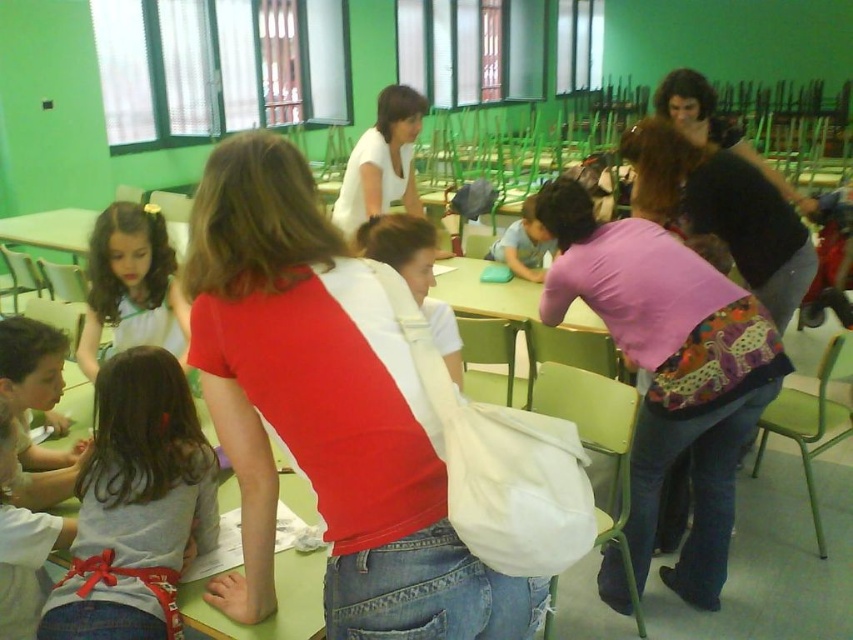
Question: Which of these objects is positioned closest to the pink fabric shirt at center?

Choices:
 (A) green plastic table at center
 (B) light gray fabric shirt at center
 (C) white matte shirt at center

Answer: (A)

Question: Which point appears farthest from the camera in this image?

Choices:
 (A) (366, 188)
 (B) (138, 362)
 (C) (236, 451)
 (D) (517, 324)

Answer: (A)

Question: Is pink fabric shirt at center wider than light gray fabric shirt at center?

Choices:
 (A) no
 (B) yes

Answer: (B)

Question: Is light gray fabric shirt at center thinner than white matte shirt at center?

Choices:
 (A) yes
 (B) no

Answer: (A)

Question: Is pink fabric shirt at center above light gray fabric shirt at center?

Choices:
 (A) yes
 (B) no

Answer: (A)

Question: Which point is closer to the camera?

Choices:
 (A) light gray fabric shirt at center
 (B) matte white shirt at center

Answer: (A)